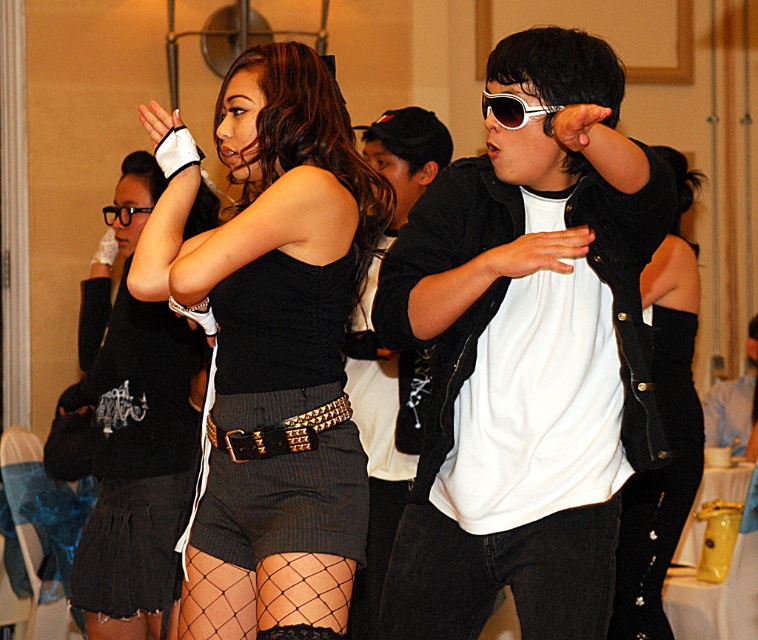
You are standing in the room and want to reach both the point at coordinates (x=684, y=188) and the point at coordinates (x=518, y=108). Which point will you reach first?

You will reach point (x=684, y=188) first because it is closer to you than point (x=518, y=108).

Consider the image. You are a photographer trying to capture a closeup of the studded leather belt at center and the white plastic sunglasses at center. Which object should you focus on first to ensure it appears sharp in the photo?

The studded leather belt at center is closer to the viewer than the white plastic sunglasses at center, so you should focus on the studded leather belt at center first to ensure it appears sharp.